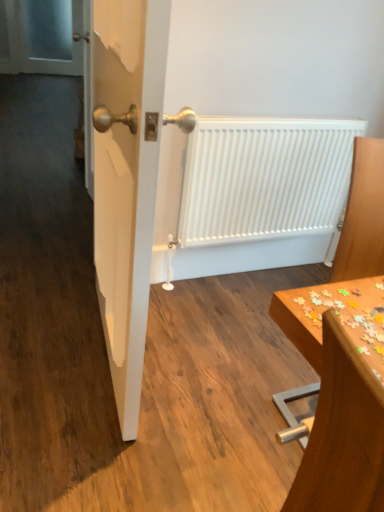
You are a GUI agent. You are given a task and a screenshot of the screen. Output one action in this format:
    pyautogui.click(x=<x>, y=<y>)
    Task: Click on the free spot above wooden puzzle pieces at lower right (from a real-world perspective)
    The image size is (384, 512).
    Given the screenshot: What is the action you would take?
    pyautogui.click(x=359, y=311)